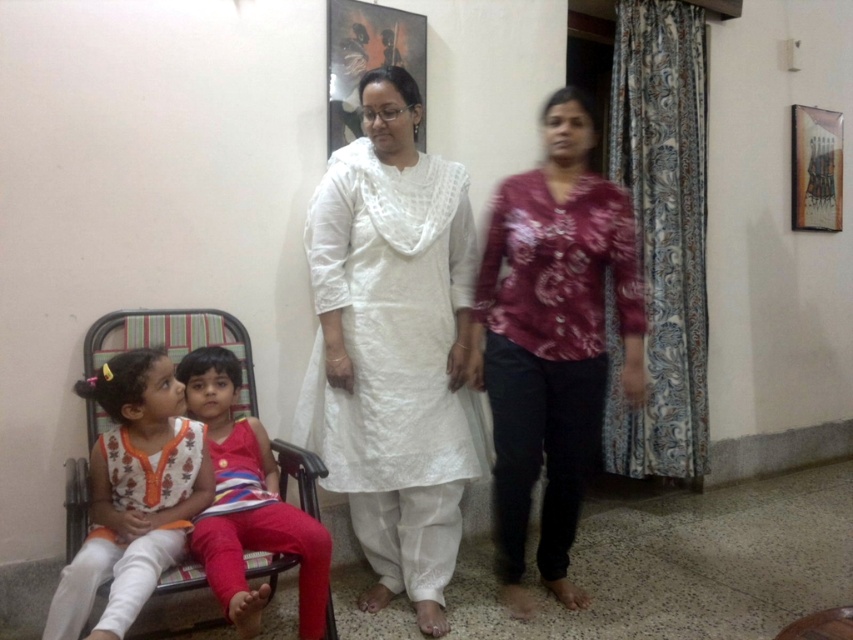
You are standing in the living room and want to place a small decorative item between the two points labeled point [476,365] and point [219,468]. Which point should the item be closer to in order to be nearer to the viewer?

The decorative item should be placed closer to point [476,365] because it is closer to the viewer compared to point [219,468].

You are standing in the living room and want to reach both points in the scene. Which point, point (x=343, y=266) or point (x=287, y=522), is closer to you?

Point (x=343, y=266) is closer to you because it is further to the viewer than point (x=287, y=522).